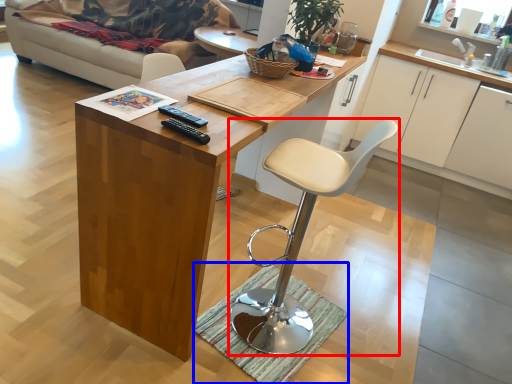
Question: Which object is closer to the camera taking this photo, chair (highlighted by a red box) or doormat (highlighted by a blue box)?

Choices:
 (A) chair
 (B) doormat

Answer: (A)